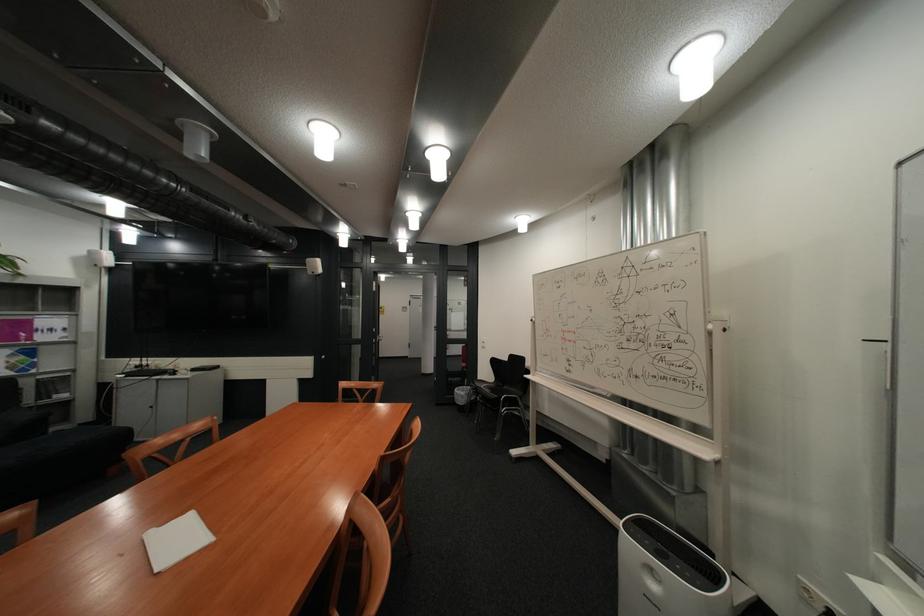
What do you see at coordinates (666, 573) in the screenshot?
I see `the white air purifier` at bounding box center [666, 573].